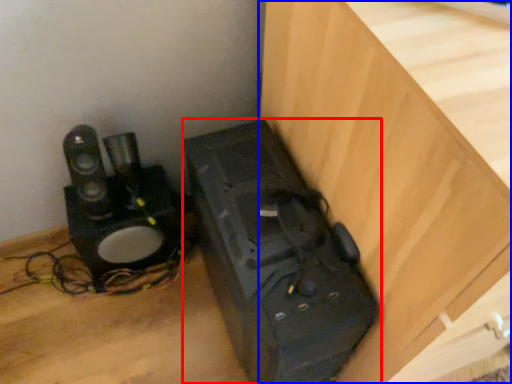
Question: Which object is closer to the camera taking this photo, appliance (highlighted by a red box) or furniture (highlighted by a blue box)?

Choices:
 (A) appliance
 (B) furniture

Answer: (B)